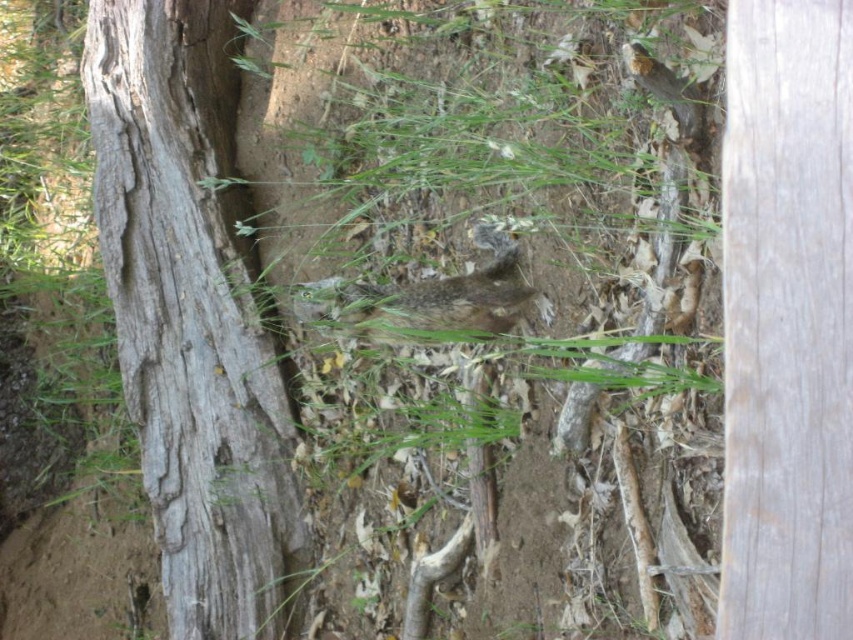
Question: Which point is closer to the camera taking this photo?

Choices:
 (A) (773, 516)
 (B) (527, 298)

Answer: (A)

Question: Can you confirm if gray rough bark tree trunk at left is positioned above fuzzy brown squirrel at center?

Choices:
 (A) yes
 (B) no

Answer: (B)

Question: From the image, what is the correct spatial relationship of weathered wood at right in relation to fuzzy brown squirrel at center?

Choices:
 (A) left
 (B) right

Answer: (B)

Question: Which object is positioned farthest from the gray rough bark tree trunk at left?

Choices:
 (A) weathered wood at right
 (B) fuzzy brown squirrel at center

Answer: (A)

Question: Estimate the real-world distances between objects in this image. Which object is closer to the gray rough bark tree trunk at left?

Choices:
 (A) fuzzy brown squirrel at center
 (B) weathered wood at right

Answer: (A)

Question: Is gray rough bark tree trunk at left above fuzzy brown squirrel at center?

Choices:
 (A) yes
 (B) no

Answer: (B)